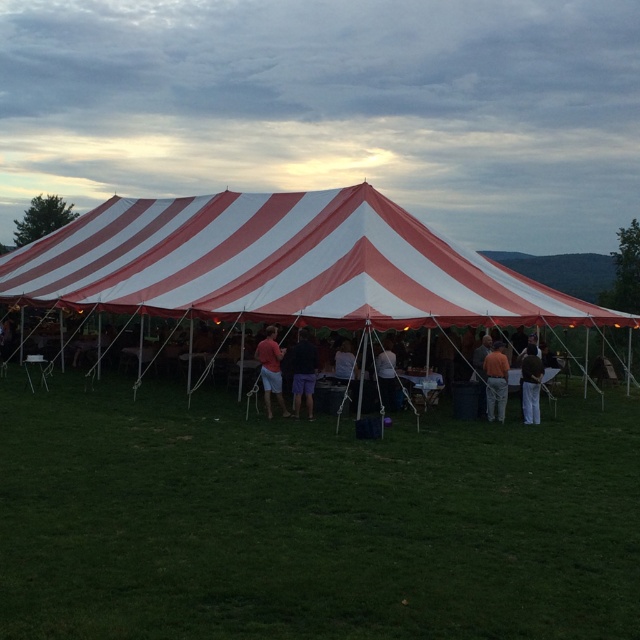
You are standing at the entrance of the large red and white striped tent and want to find the orange cotton shirt at center. Based on the coordinates given, can you determine the direction you should walk to locate it?

The orange cotton shirt at center is located at coordinates point [496,381]. Since the coordinate system typically starts at the bottom left corner, moving towards higher x values means going to the right and higher y values means going upwards. Therefore, to reach the orange cotton shirt at center, you should walk towards the upper right direction from the entrance.

You are a photographer positioned at the front of the tent. You want to take a photo of both the orange cotton shirt at center and the brown fabric pants at right. Which object is closer to you and will be in focus first?

The orange cotton shirt at center is closer to you, so it will be in focus first before the brown fabric pants at right.